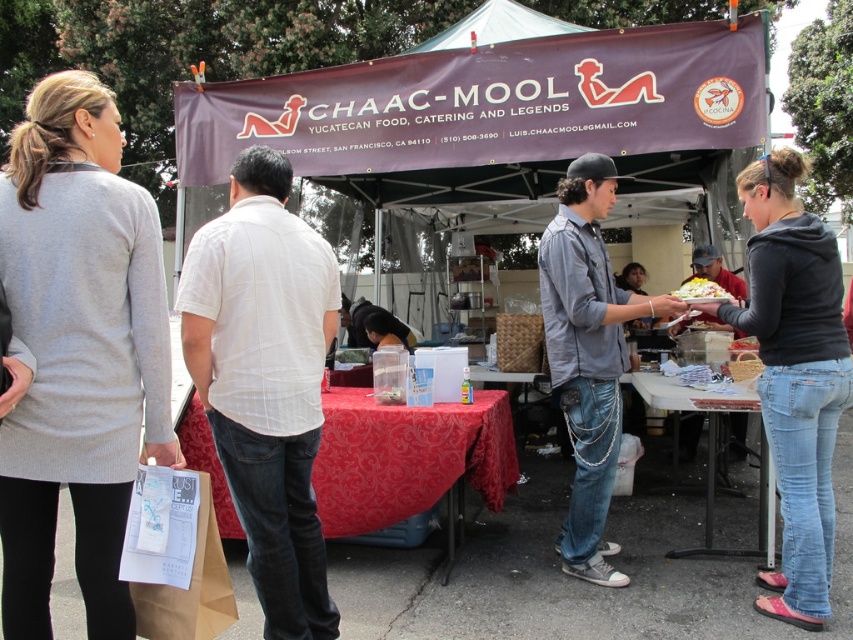
You are a customer at the CHAAC MOOL market stall. You see a dark gray hoodie at center and a red damask tablecloth at center. Which item is positioned to the right side?

The dark gray hoodie at center is positioned to the right of the red damask tablecloth at center.

You are a customer at the CHAAC MOOL event looking for the dark gray hoodie at center. According to the coordinates provided, where exactly is the hoodie positioned relative to the tented area?

The dark gray hoodie at center is located at point coordinates 0.588 on the x axis and 0.932 on the y axis, so it is positioned near the lower middle part of the tented area.